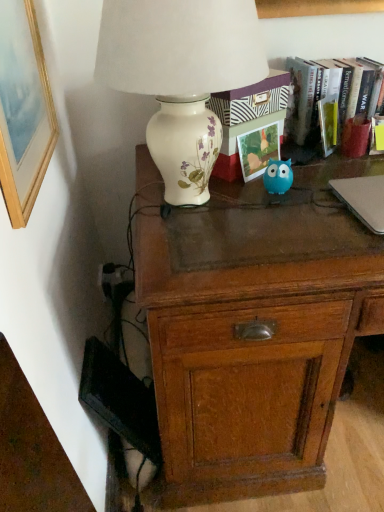
I want to click on unoccupied region to the right of porcelain floral lamp at upper left, so click(x=314, y=201).